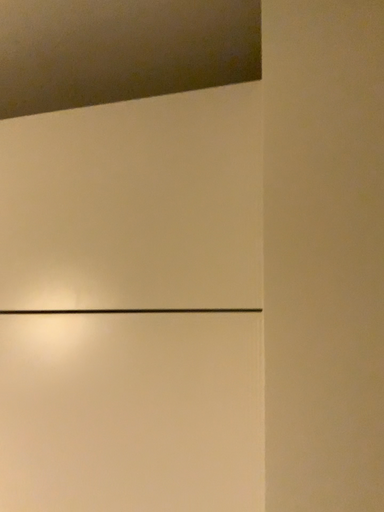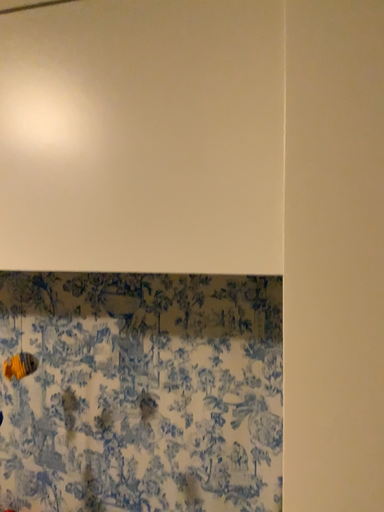
Question: Which way did the camera rotate in the video?

Choices:
 (A) rotated downward
 (B) rotated upward

Answer: (A)